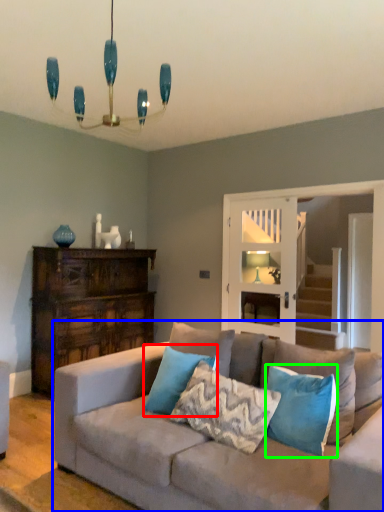
Question: Which object is the closest to the pillow (highlighted by a red box)? Choose among these: studio couch (highlighted by a blue box) or pillow (highlighted by a green box).

Choices:
 (A) studio couch
 (B) pillow

Answer: (A)